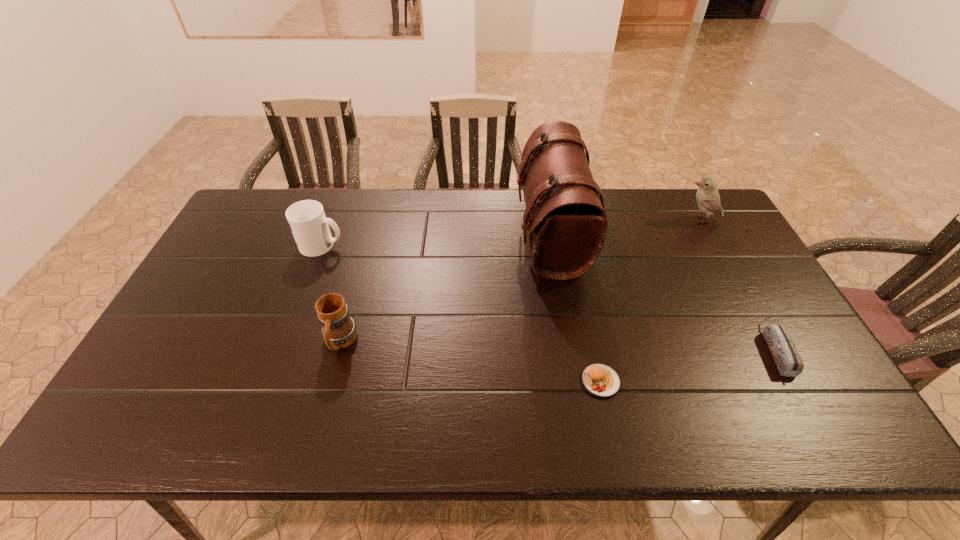
I want to click on vacant space that is in between the pencil box and the patty, so click(688, 365).

Find the location of `vacant region between the bird and the pencil box`. vacant region between the bird and the pencil box is located at coordinates (737, 285).

Where is `unoccupied position between the pencil box and the satchel`? unoccupied position between the pencil box and the satchel is located at coordinates (663, 292).

Locate an element on the screen. vacant region between the pencil box and the left mug is located at coordinates (549, 297).

You are a GUI agent. You are given a task and a screenshot of the screen. Output one action in this format:
    pyautogui.click(x=<x>, y=<y>)
    Task: Click on the vacant area that lies between the nearer mug and the pencil box
    The width and height of the screenshot is (960, 540).
    Given the screenshot: What is the action you would take?
    pyautogui.click(x=558, y=346)

Locate an element on the screen. free space between the bird and the fifth object from right to left is located at coordinates tap(520, 281).

Locate an element on the screen. The image size is (960, 540). vacant space in between the fifth shortest object and the second object from left to right is located at coordinates pos(520,281).

Image resolution: width=960 pixels, height=540 pixels. What are the coordinates of `free area in between the pencil box and the nearer mug` in the screenshot? It's located at (558, 346).

Identify which object is located as the fourth nearest to the patty. Please provide its 2D coordinates. Your answer should be formatted as a tuple, i.e. [(x, y)], where the tuple contains the x and y coordinates of a point satisfying the conditions above.

[(708, 199)]

Where is `object that stands as the fourth closest to the second object from left to right`? The width and height of the screenshot is (960, 540). object that stands as the fourth closest to the second object from left to right is located at coordinates (786, 356).